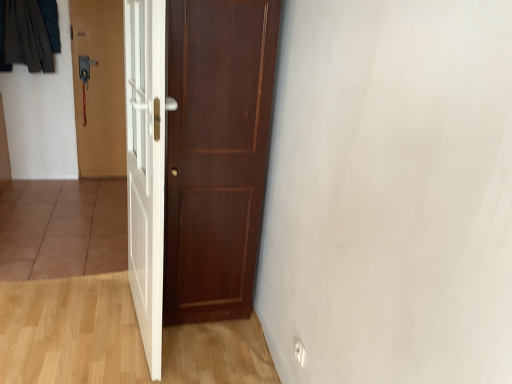
Where is `vacant area that is in front of white glossy door at center, the third door when ordered from back to front`? The image size is (512, 384). vacant area that is in front of white glossy door at center, the third door when ordered from back to front is located at coordinates click(104, 360).